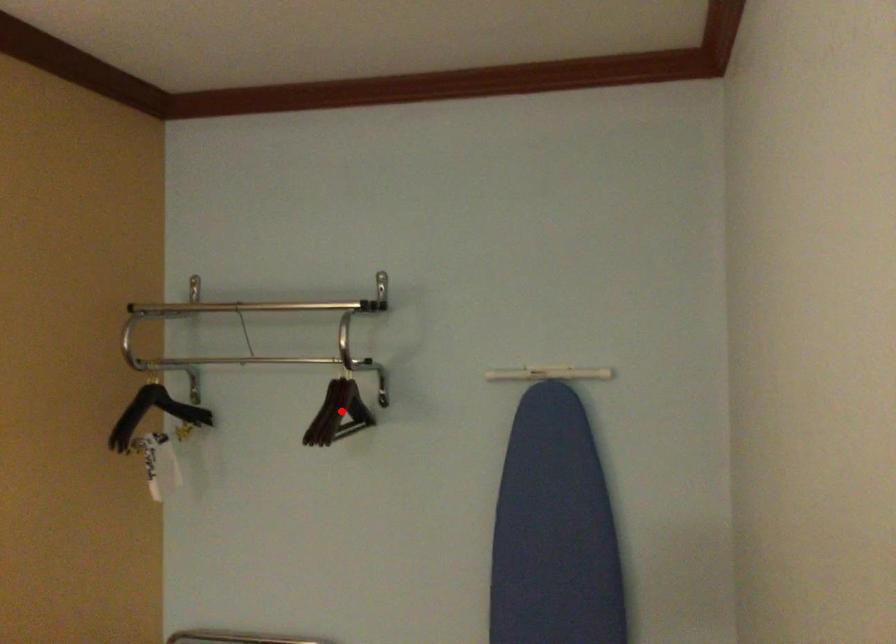
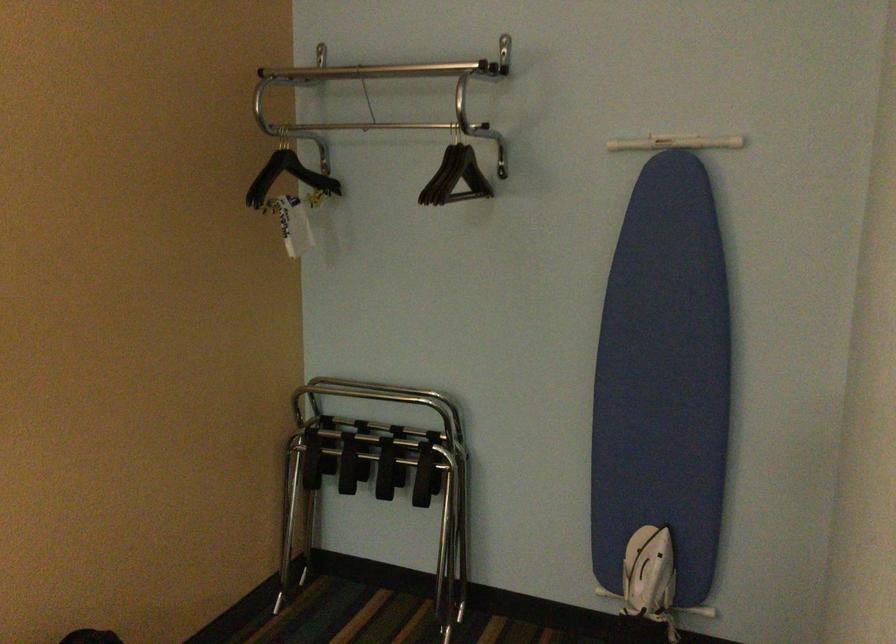
Question: I am providing you with two images of the same scene from different viewpoints. A red point is marked on the first image. At the location where the point appears in image 1, is it still visible in image 2?

Choices:
 (A) Yes
 (B) No

Answer: (A)